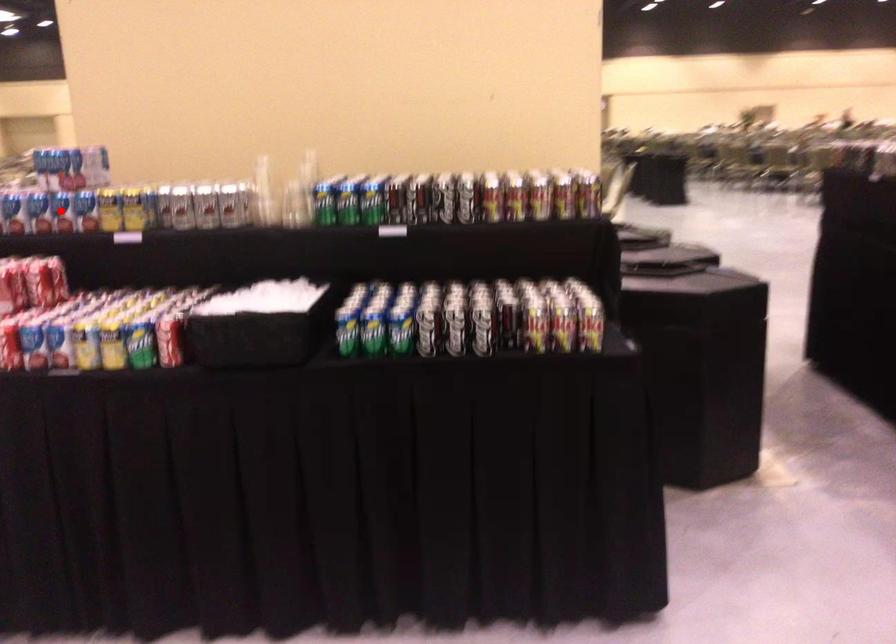
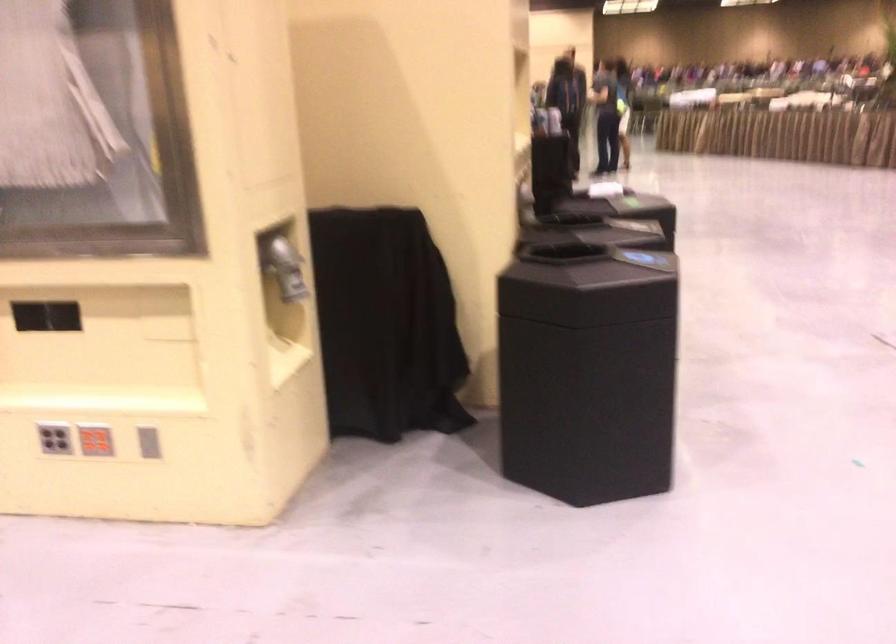
Question: I am providing you with two images of the same scene from different viewpoints. A red point is marked on the first image. At the location where the point appears in image 1, is it still visible in image 2?

Choices:
 (A) Yes
 (B) No

Answer: (B)